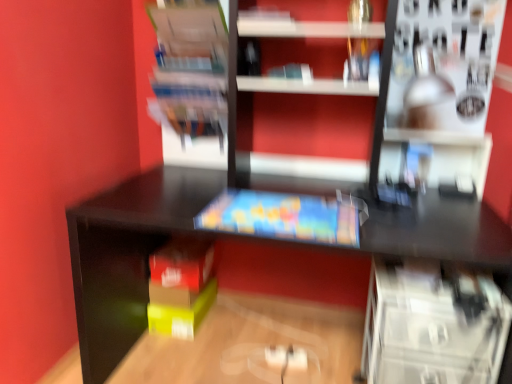
How much space does satin silver lamp at upper right, the 2th shelf when ordered from bottom to top, occupy vertically?

The height of satin silver lamp at upper right, the 2th shelf when ordered from bottom to top, is 20.35 inches.

In order to face transparent plastic drawers at lower right, which is counted as the second shelf, starting from the right, should I rotate leftwards or rightwards?

A 20.318 degree turn to the right will do.

You are a GUI agent. You are given a task and a screenshot of the screen. Output one action in this format:
    pyautogui.click(x=<x>, y=<y>)
    Task: Click on the transparent plastic drawers at lower right, which is counted as the second shelf, starting from the right
    Image resolution: width=512 pixels, height=384 pixels.
    Given the screenshot: What is the action you would take?
    pyautogui.click(x=433, y=324)

In order to click on satin silver lamp at upper right, which ranks as the first shelf in right-to-left order in this screenshot , I will do `click(436, 69)`.

Is transparent plastic drawers at lower right, marked as the third shelf in a top-to-bottom arrangement, facing away from matte plastic books at upper left, the first shelf viewed from the top?

transparent plastic drawers at lower right, marked as the third shelf in a top-to-bottom arrangement, is not turned away from matte plastic books at upper left, the first shelf viewed from the top.

I want to click on the 2nd shelf above the transparent plastic drawers at lower right, marked as the third shelf in a top-to-bottom arrangement (from the image's perspective), so click(x=192, y=79).

Considering their positions, is transparent plastic drawers at lower right, which is counted as the 1th shelf, starting from the bottom, located in front of or behind matte plastic books at upper left, which is the third shelf in right-to-left order?

Visually, transparent plastic drawers at lower right, which is counted as the 1th shelf, starting from the bottom, is located in front of matte plastic books at upper left, which is the third shelf in right-to-left order.

What's the angular difference between transparent plastic drawers at lower right, which is counted as the second shelf, starting from the right, and matte plastic books at upper left, which is the third shelf in right-to-left order,'s facing directions?

transparent plastic drawers at lower right, which is counted as the second shelf, starting from the right, and matte plastic books at upper left, which is the third shelf in right-to-left order, are facing 0.702 degrees away from each other.

From the image's perspective, does matte plastic book at center appear lower than satin silver lamp at upper right, the second shelf positioned from the top?

Yes.

Is point (311, 210) closer to viewer compared to point (398, 114)?

Yes, it is.

Is matte plastic book at center in front of or behind satin silver lamp at upper right, which ranks as the first shelf in right-to-left order, in the image?

matte plastic book at center is behind satin silver lamp at upper right, which ranks as the first shelf in right-to-left order.

Considering the sizes of objects satin silver lamp at upper right, the third shelf positioned from the left, and transparent plastic drawers at lower right, which is counted as the second shelf, starting from the right, in the image provided, who is thinner, satin silver lamp at upper right, the third shelf positioned from the left, or transparent plastic drawers at lower right, which is counted as the second shelf, starting from the right,?

Thinner between the two is transparent plastic drawers at lower right, which is counted as the second shelf, starting from the right.

Starting from the satin silver lamp at upper right, the 2th shelf when ordered from bottom to top, which shelf is the 1st one behind? Please provide its 2D coordinates.

[(433, 324)]

Is transparent plastic drawers at lower right, which is counted as the 1th shelf, starting from the bottom, at the back of satin silver lamp at upper right, the second shelf positioned from the top?

No.

Is matte plastic books at upper left, which is the first shelf in left-to-right order, oriented away from satin silver lamp at upper right, the second shelf positioned from the top?

No, matte plastic books at upper left, which is the first shelf in left-to-right order, is not facing the opposite direction of satin silver lamp at upper right, the second shelf positioned from the top.

Is matte plastic books at upper left, which ranks as the 3th shelf in bottom-to-top order, shorter than satin silver lamp at upper right, the third shelf positioned from the left?

Incorrect, the height of matte plastic books at upper left, which ranks as the 3th shelf in bottom-to-top order, does not fall short of that of satin silver lamp at upper right, the third shelf positioned from the left.

Can you confirm if matte plastic books at upper left, the first shelf viewed from the top, is bigger than satin silver lamp at upper right, the second shelf positioned from the top?

No.

Is transparent plastic drawers at lower right, placed as the 2th shelf when sorted from left to right, taller than matte plastic book at center?

Yes.

Is transparent plastic drawers at lower right, which is counted as the 1th shelf, starting from the bottom, oriented towards matte plastic book at center?

No, transparent plastic drawers at lower right, which is counted as the 1th shelf, starting from the bottom, is not aimed at matte plastic book at center.

Is transparent plastic drawers at lower right, which is counted as the second shelf, starting from the right, directly adjacent to matte plastic book at center?

No, transparent plastic drawers at lower right, which is counted as the second shelf, starting from the right, is not with matte plastic book at center.

Is point (486, 277) less distant than point (288, 201)?

Yes, point (486, 277) is in front of point (288, 201).

Does matte plastic books at upper left, which is the first shelf in left-to-right order, have a smaller size compared to transparent plastic drawers at lower right, marked as the third shelf in a top-to-bottom arrangement?

Correct, matte plastic books at upper left, which is the first shelf in left-to-right order, occupies less space than transparent plastic drawers at lower right, marked as the third shelf in a top-to-bottom arrangement.

Is matte plastic books at upper left, which is the first shelf in left-to-right order, not near transparent plastic drawers at lower right, which is counted as the second shelf, starting from the right?

Indeed, matte plastic books at upper left, which is the first shelf in left-to-right order, is not near transparent plastic drawers at lower right, which is counted as the second shelf, starting from the right.

From a real-world perspective, between matte plastic books at upper left, which is the first shelf in left-to-right order, and transparent plastic drawers at lower right, which is counted as the 1th shelf, starting from the bottom, who is vertically higher?

matte plastic books at upper left, which is the first shelf in left-to-right order, from a real-world perspective.

From a real-world perspective, relative to matte plastic book at center, is matte plastic books at upper left, which is the third shelf in right-to-left order, vertically above or below?

In terms of real-world spatial position, matte plastic books at upper left, which is the third shelf in right-to-left order, is above matte plastic book at center.

From the image's perspective, is matte plastic books at upper left, which is the first shelf in left-to-right order, beneath matte plastic book at center?

Actually, matte plastic books at upper left, which is the first shelf in left-to-right order, appears above matte plastic book at center in the image.

Is matte plastic books at upper left, which is the third shelf in right-to-left order, wider or thinner than matte plastic book at center?

matte plastic books at upper left, which is the third shelf in right-to-left order, is thinner than matte plastic book at center.

From the picture: How distant is matte plastic books at upper left, which ranks as the 3th shelf in bottom-to-top order, from matte plastic book at center?

22.61 inches.

Locate an element on the screen. This screenshot has width=512, height=384. shelf located behind the transparent plastic drawers at lower right, which is counted as the 1th shelf, starting from the bottom is located at coordinates (192, 79).

This screenshot has width=512, height=384. What are the coordinates of `book below the satin silver lamp at upper right, the second shelf positioned from the top (from the image's perspective)` in the screenshot? It's located at (285, 217).

Based on their spatial positions, is transparent plastic drawers at lower right, which is counted as the second shelf, starting from the right, or matte plastic book at center further from matte plastic books at upper left, which ranks as the 3th shelf in bottom-to-top order?

transparent plastic drawers at lower right, which is counted as the second shelf, starting from the right, lies further to matte plastic books at upper left, which ranks as the 3th shelf in bottom-to-top order, than the other object.

Based on their spatial positions, is matte plastic book at center or transparent plastic drawers at lower right, placed as the 2th shelf when sorted from left to right, further from satin silver lamp at upper right, which ranks as the first shelf in right-to-left order?

Based on the image, transparent plastic drawers at lower right, placed as the 2th shelf when sorted from left to right, appears to be further to satin silver lamp at upper right, which ranks as the first shelf in right-to-left order.

Looking at the image, which one is located closer to matte plastic books at upper left, the first shelf viewed from the top, matte plastic book at center or transparent plastic drawers at lower right, marked as the third shelf in a top-to-bottom arrangement?

The object closer to matte plastic books at upper left, the first shelf viewed from the top, is matte plastic book at center.

From the image, which object appears to be nearer to transparent plastic drawers at lower right, placed as the 2th shelf when sorted from left to right, matte plastic book at center or satin silver lamp at upper right, the second shelf positioned from the top?

matte plastic book at center lies closer to transparent plastic drawers at lower right, placed as the 2th shelf when sorted from left to right, than the other object.

Consider the image. Estimate the real-world distances between objects in this image. Which object is closer to matte plastic book at center, transparent plastic drawers at lower right, which is counted as the second shelf, starting from the right, or satin silver lamp at upper right, the third shelf positioned from the left?

transparent plastic drawers at lower right, which is counted as the second shelf, starting from the right.

Based on their spatial positions, is matte plastic books at upper left, which ranks as the 3th shelf in bottom-to-top order, or transparent plastic drawers at lower right, which is counted as the second shelf, starting from the right, further from satin silver lamp at upper right, the 2th shelf when ordered from bottom to top?

matte plastic books at upper left, which ranks as the 3th shelf in bottom-to-top order, is further to satin silver lamp at upper right, the 2th shelf when ordered from bottom to top.

Based on their spatial positions, is satin silver lamp at upper right, the third shelf positioned from the left, or matte plastic books at upper left, which is the third shelf in right-to-left order, further from matte plastic book at center?

Among the two, satin silver lamp at upper right, the third shelf positioned from the left, is located further to matte plastic book at center.

In the scene shown: Estimate the real-world distances between objects in this image. Which object is closer to matte plastic books at upper left, which ranks as the 3th shelf in bottom-to-top order, satin silver lamp at upper right, which ranks as the first shelf in right-to-left order, or transparent plastic drawers at lower right, marked as the third shelf in a top-to-bottom arrangement?

Based on the image, satin silver lamp at upper right, which ranks as the first shelf in right-to-left order, appears to be nearer to matte plastic books at upper left, which ranks as the 3th shelf in bottom-to-top order.

Locate an element on the screen. book between matte plastic books at upper left, which is the first shelf in left-to-right order, and transparent plastic drawers at lower right, which is counted as the 1th shelf, starting from the bottom, in the vertical direction is located at coordinates (285, 217).

You are a GUI agent. You are given a task and a screenshot of the screen. Output one action in this format:
    pyautogui.click(x=<x>, y=<y>)
    Task: Click on the shelf between matte plastic books at upper left, which is the third shelf in right-to-left order, and transparent plastic drawers at lower right, which is counted as the second shelf, starting from the right, in the vertical direction
    
    Given the screenshot: What is the action you would take?
    pyautogui.click(x=436, y=69)

Where is `book between satin silver lamp at upper right, the 2th shelf when ordered from bottom to top, and transparent plastic drawers at lower right, placed as the 2th shelf when sorted from left to right, in the vertical direction`? book between satin silver lamp at upper right, the 2th shelf when ordered from bottom to top, and transparent plastic drawers at lower right, placed as the 2th shelf when sorted from left to right, in the vertical direction is located at coordinates [x=285, y=217].

You are a GUI agent. You are given a task and a screenshot of the screen. Output one action in this format:
    pyautogui.click(x=<x>, y=<y>)
    Task: Click on the book situated between matte plastic books at upper left, which is the first shelf in left-to-right order, and satin silver lamp at upper right, the third shelf positioned from the left, from left to right
    This screenshot has width=512, height=384.
    Given the screenshot: What is the action you would take?
    pyautogui.click(x=285, y=217)